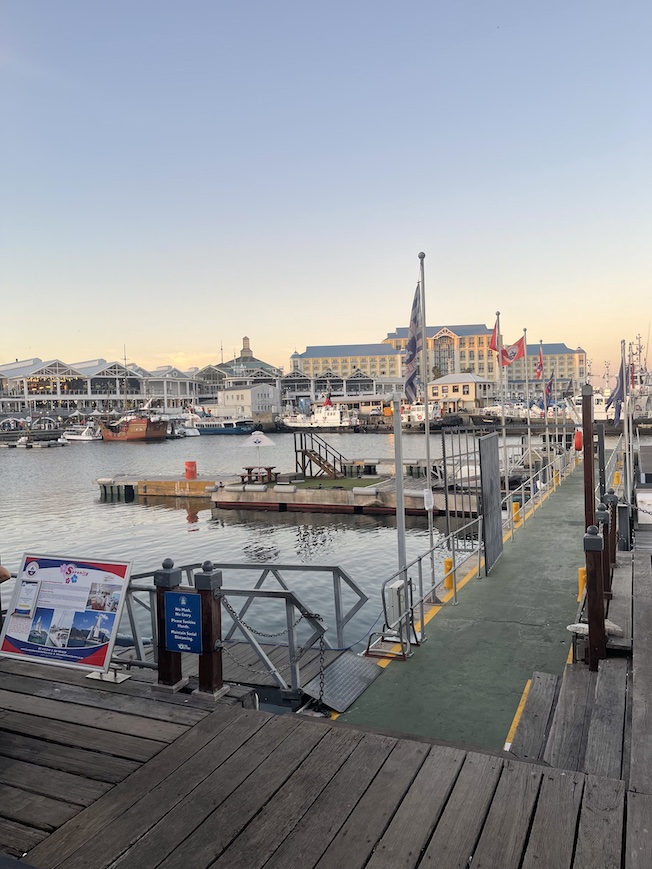
Where is `planks`? Image resolution: width=652 pixels, height=869 pixels. planks is located at coordinates (360, 784), (379, 785), (431, 799).